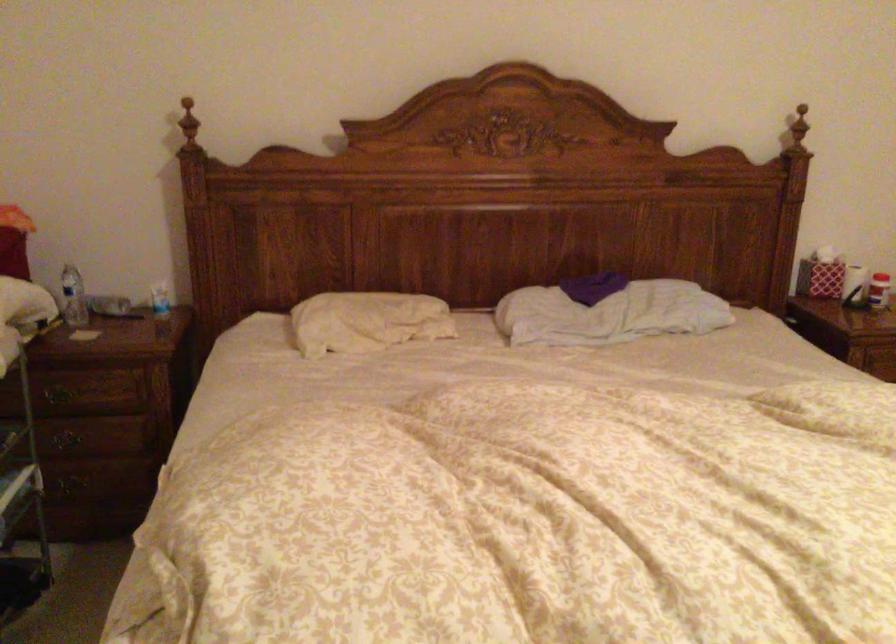
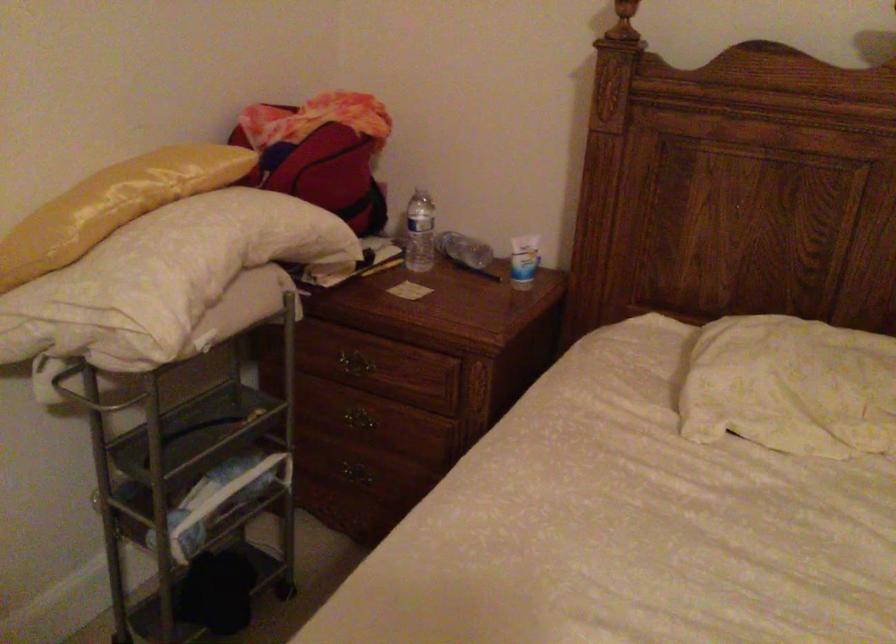
In the second image, find the point that corresponds to (79,295) in the first image.

(419, 232)